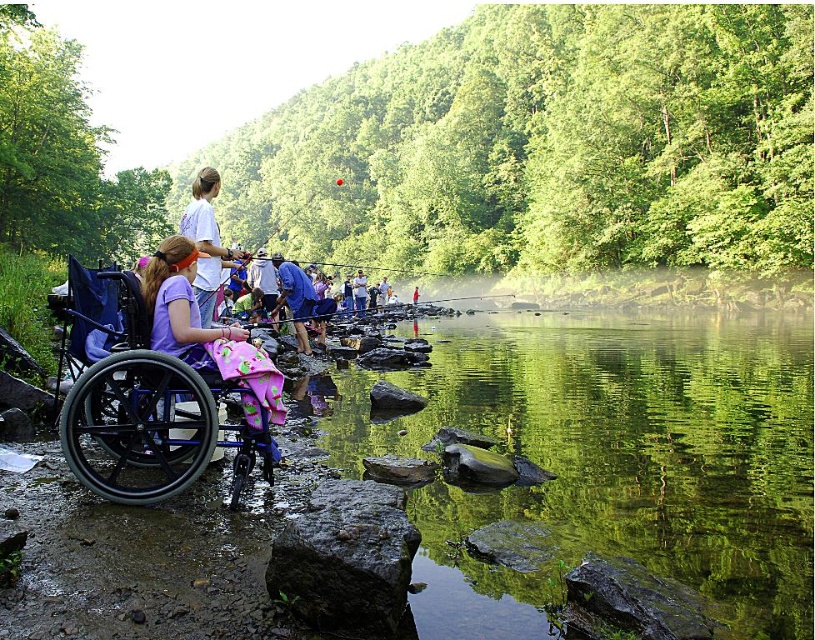
You are a park ranger assessing accessibility for a new wheelchair path. The path must be at least 12 meters long to accommodate a gentle slope. Based on the scene, is the distance between the matte purple shirt at center and the blue fabric at center sufficient for this requirement?

The distance between the matte purple shirt at center and the blue fabric at center is 11.73 meters, which is slightly shorter than the required 12 meters. Therefore, the path would not meet the length requirement for the wheelchair path.

You are a photographer standing at the edge of the water. You want to take a picture of the person in the blue wheelchair and the person wearing the matte purple shirt at center. Based on their positions, which one is closer to you?

The person in the blue wheelchair is closer to you because the matte purple shirt at center is located at point (179, 305), which is further away in the scene.